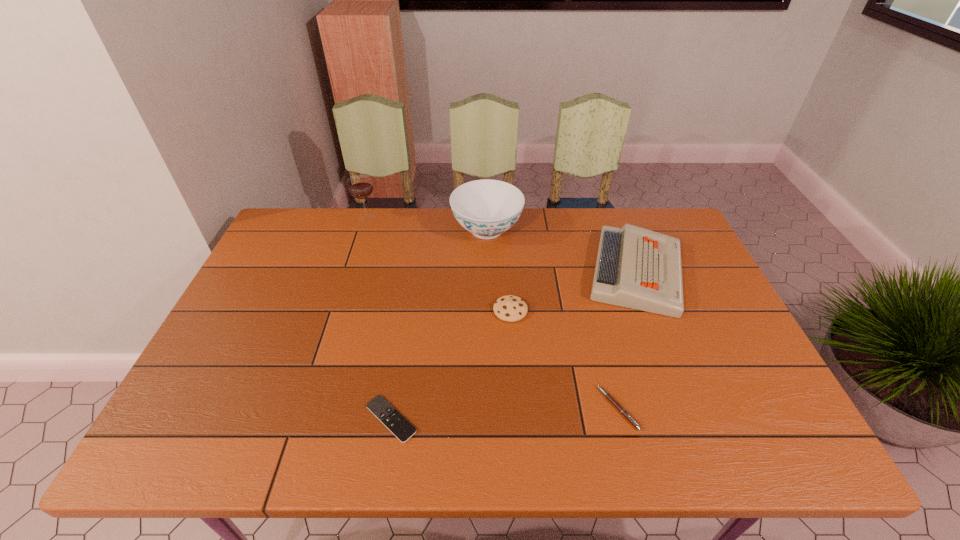
Locate an element on the screen. vacant area between the third shortest object and the tallest object is located at coordinates (439, 264).

The height and width of the screenshot is (540, 960). Find the location of `free space between the second shortest object and the third tallest object`. free space between the second shortest object and the third tallest object is located at coordinates (627, 340).

Where is `vacant area that lies between the shortest object and the fourth tallest object`? This screenshot has width=960, height=540. vacant area that lies between the shortest object and the fourth tallest object is located at coordinates (450, 365).

At what (x,y) coordinates should I click in order to perform the action: click on free space between the pen and the third tallest object. Please return your answer as a coordinate pair (x, y). Looking at the image, I should click on (627, 340).

The width and height of the screenshot is (960, 540). Find the location of `empty space that is in between the shortest object and the leftmost object`. empty space that is in between the shortest object and the leftmost object is located at coordinates (379, 318).

Find the location of `vacant point located between the second object from left to right and the leftmost object`. vacant point located between the second object from left to right and the leftmost object is located at coordinates (379, 318).

Find the location of a particular element. vacant area between the chinaware and the fourth tallest object is located at coordinates (498, 271).

Locate an element on the screen. free space between the pen and the wineglass is located at coordinates (492, 313).

What are the coordinates of `unoccupied area between the fifth object from right to left and the third tallest object` in the screenshot? It's located at (514, 346).

Find the location of `empty location between the tallest object and the second shortest object`. empty location between the tallest object and the second shortest object is located at coordinates (492, 313).